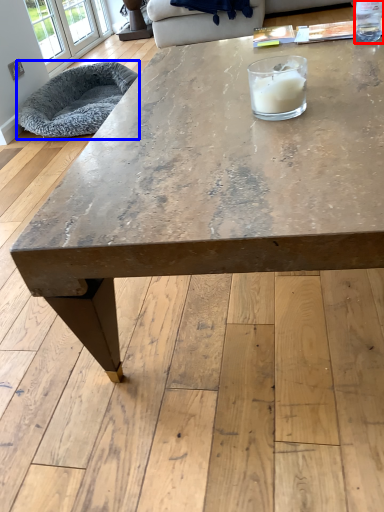
Question: Which object appears farthest to the camera in this image, beverage (highlighted by a red box) or armchair (highlighted by a blue box)?

Choices:
 (A) beverage
 (B) armchair

Answer: (B)